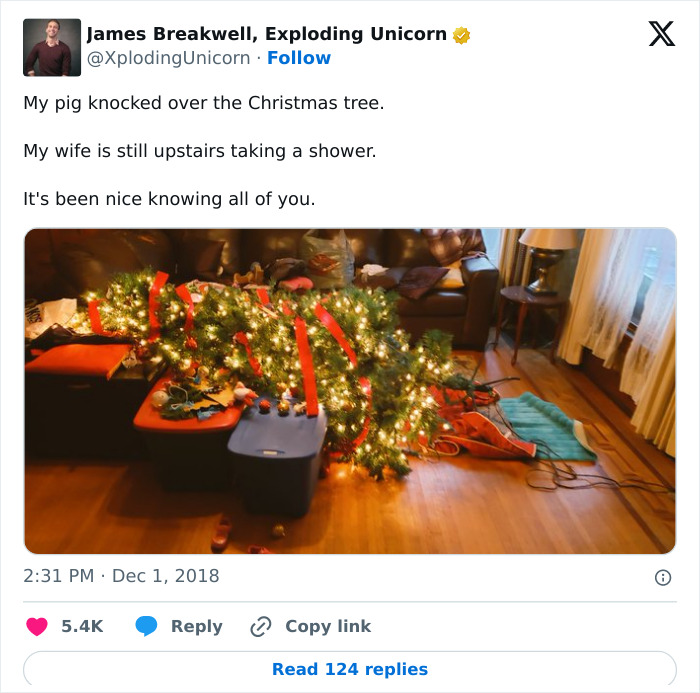
Identify the location of knocked over christmas tree. The height and width of the screenshot is (693, 700). (283, 315).